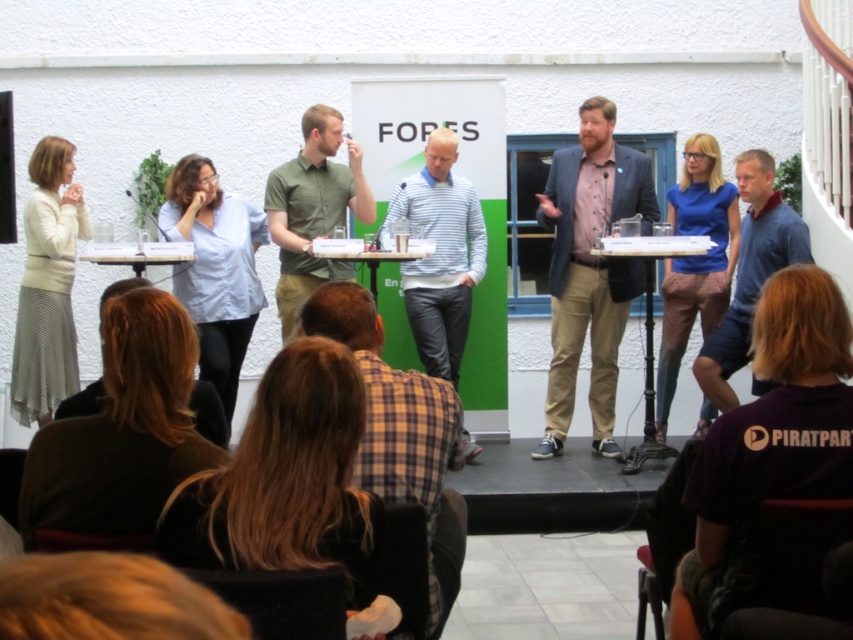
Question: Which point is closer to the camera?

Choices:
 (A) (815, 321)
 (B) (461, 417)
 (C) (45, 362)
 (D) (172, 540)

Answer: (D)

Question: Where is blonde hair at lower center located in relation to striped cotton shirt at center in the image?

Choices:
 (A) below
 (B) above

Answer: (A)

Question: Estimate the real-world distances between objects in this image. Which object is farther from the green matte shirt at center?

Choices:
 (A) dark purple t-shirt at lower right
 (B) striped cotton shirt at center
 (C) dark brown leather jacket at lower left

Answer: (A)

Question: Can you confirm if dark brown leather jacket at lower left is smaller than matte blue shirt at center?

Choices:
 (A) yes
 (B) no

Answer: (A)

Question: Can you confirm if dark purple t-shirt at lower right is smaller than dark brown leather jacket at lower left?

Choices:
 (A) yes
 (B) no

Answer: (B)

Question: Among these points, which one is nearest to the camera?

Choices:
 (A) (440, 365)
 (B) (720, 384)

Answer: (B)